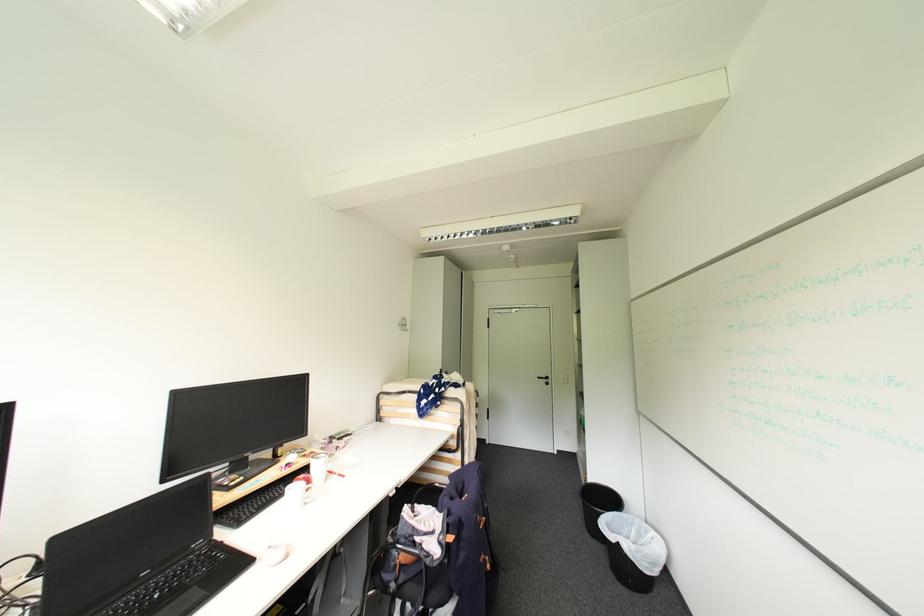
The image size is (924, 616). Identify the location of black laptop. (141, 559).